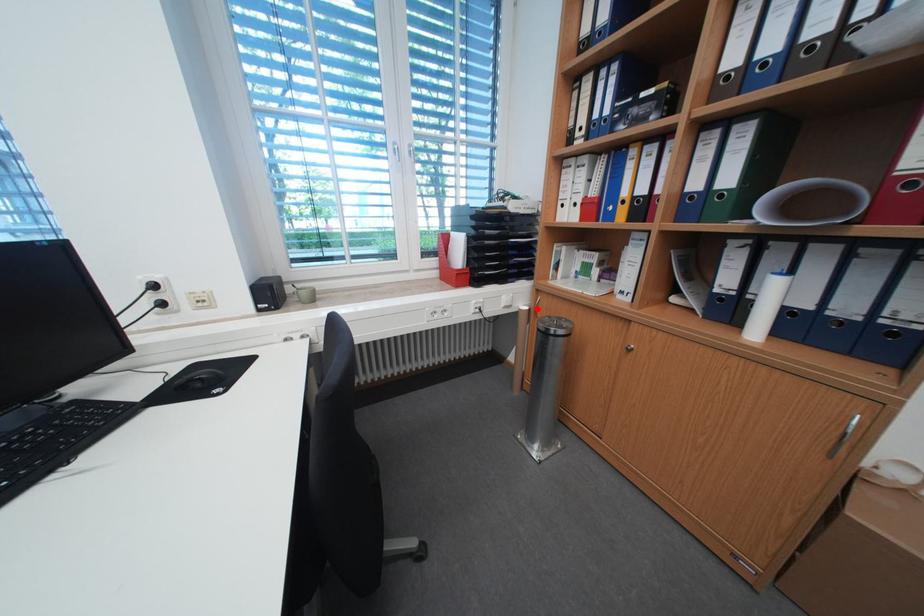
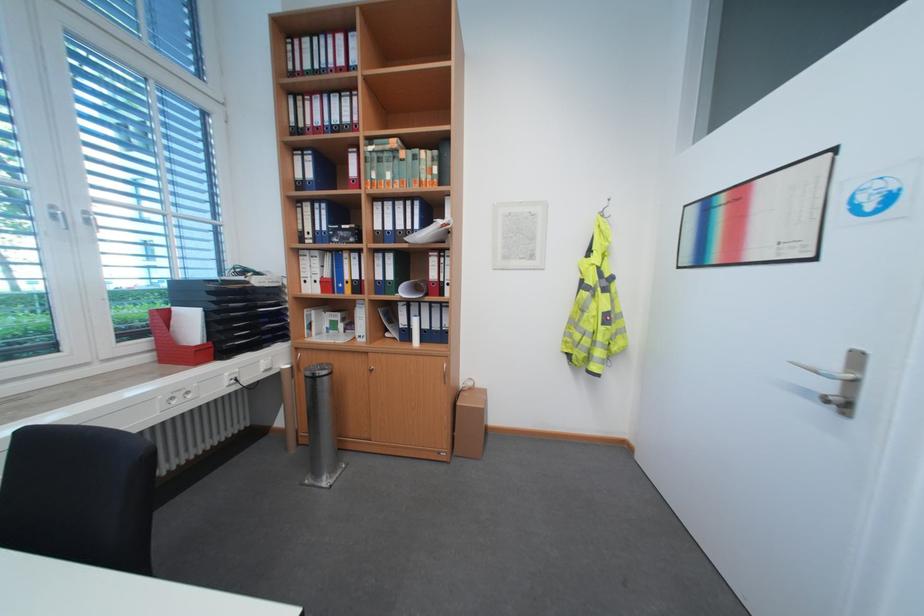
Where in the second image is the point corresponding to the highlighted location from the first image?

(299, 367)